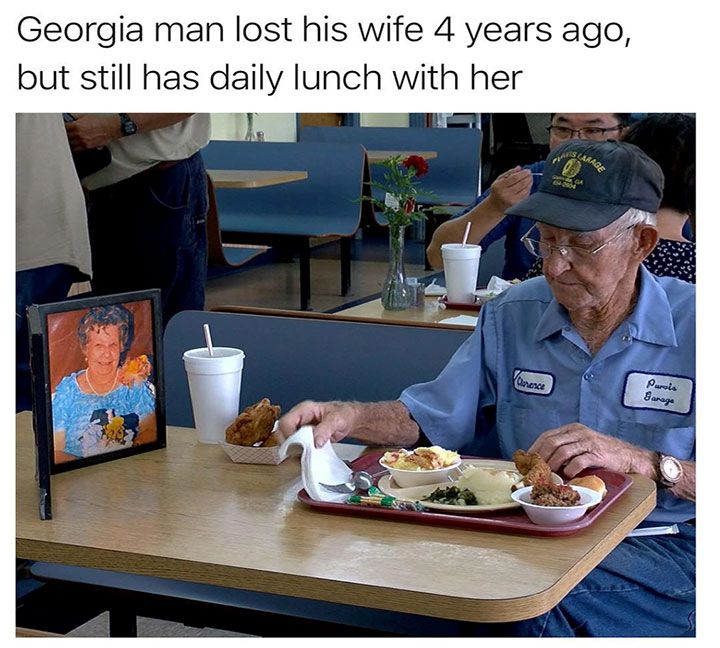
Identify the location of glass flower vase. (394, 284).